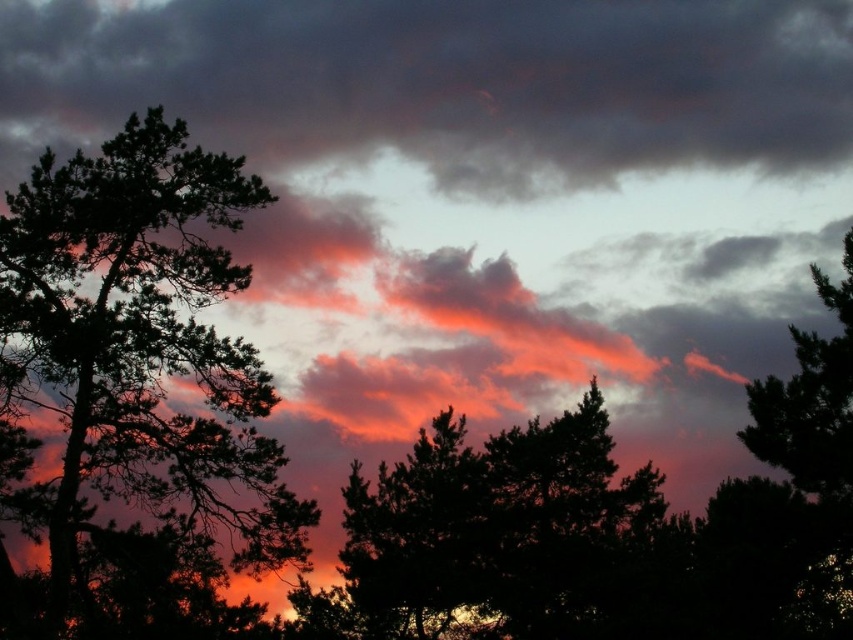
Is point (846, 61) positioned before point (32, 369)?

No, it is behind (32, 369).

Identify the location of dark gray cloud at upper center. Image resolution: width=853 pixels, height=640 pixels. (447, 81).

Locate an element on the screen. dark gray cloud at upper center is located at coordinates (447, 81).